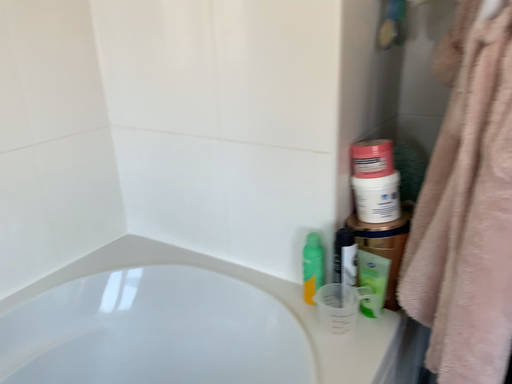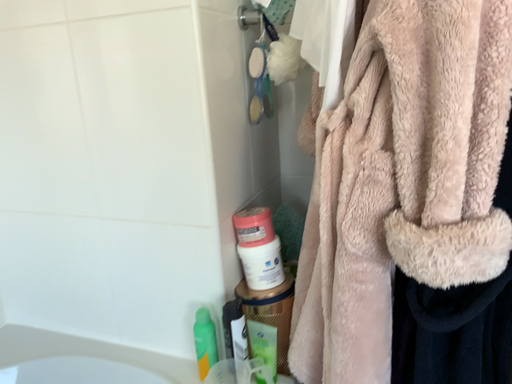
Question: Which way did the camera rotate in the video?

Choices:
 (A) rotated right
 (B) rotated left

Answer: (A)